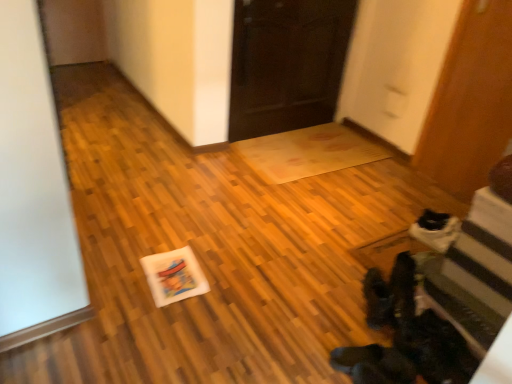
The image size is (512, 384). Find the location of `vacant space situated on the left part of wooden door at right, which ranks as the second door in left-to-right order`. vacant space situated on the left part of wooden door at right, which ranks as the second door in left-to-right order is located at coordinates (404, 187).